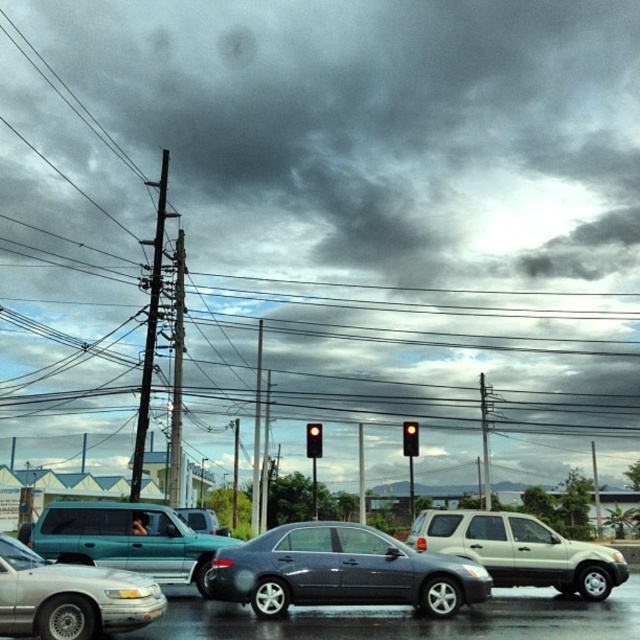
Does shiny dark gray sedan at center have a lesser height compared to metallic gray utility pole at left?

Yes.

Which is above, shiny dark gray sedan at center or metallic gray utility pole at left?

metallic gray utility pole at left is higher up.

Which is in front, point (285, 609) or point (161, 225)?

Point (285, 609)

Identify the location of shiny dark gray sedan at center. This screenshot has height=640, width=640. (340, 572).

Is dark gray cloud at upper center thinner than teal matte suv at center?

No, dark gray cloud at upper center is not thinner than teal matte suv at center.

Can you confirm if dark gray cloud at upper center is positioned above teal matte suv at center?

Yes, dark gray cloud at upper center is above teal matte suv at center.

The image size is (640, 640). What do you see at coordinates (344, 209) in the screenshot? I see `dark gray cloud at upper center` at bounding box center [344, 209].

The width and height of the screenshot is (640, 640). Find the location of `dark gray cloud at upper center`. dark gray cloud at upper center is located at coordinates (344, 209).

Can you confirm if shiny dark gray sedan at center is positioned below yellow glass traffic light at center?

Actually, shiny dark gray sedan at center is above yellow glass traffic light at center.

Is point (276, 541) positioned behind point (417, 452)?

That is False.

Where is `shiny dark gray sedan at center`? This screenshot has width=640, height=640. shiny dark gray sedan at center is located at coordinates (340, 572).